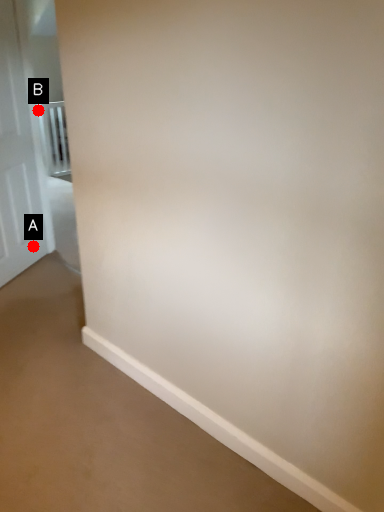
Question: Two points are circled on the image, labeled by A and B beside each circle. Which of the following is the farthest from the observer?

Choices:
 (A) A is further
 (B) B is further

Answer: (B)